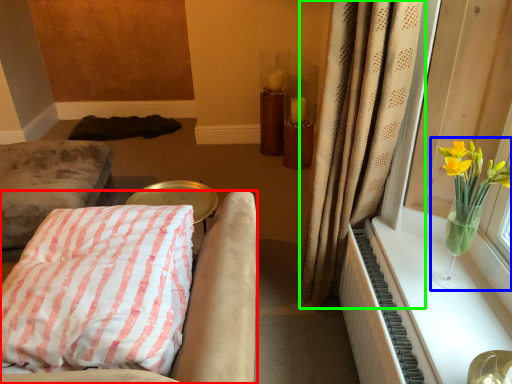
Question: Which object is positioned farthest from furniture (highlighted by a red box)? Select from floral arrangement (highlighted by a blue box) and curtain (highlighted by a green box).

Choices:
 (A) floral arrangement
 (B) curtain

Answer: (A)